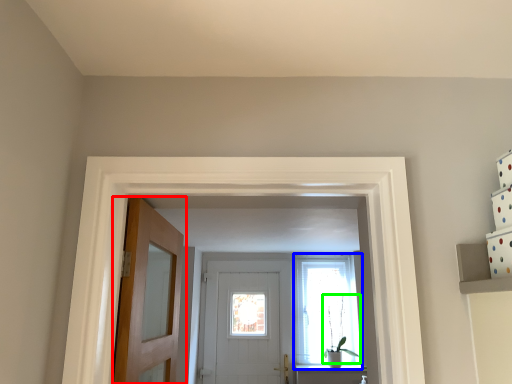
Question: Based on their relative distances, which object is nearer to door (highlighted by a red box)? Choose from window (highlighted by a blue box) and plant (highlighted by a green box).

Choices:
 (A) window
 (B) plant

Answer: (A)